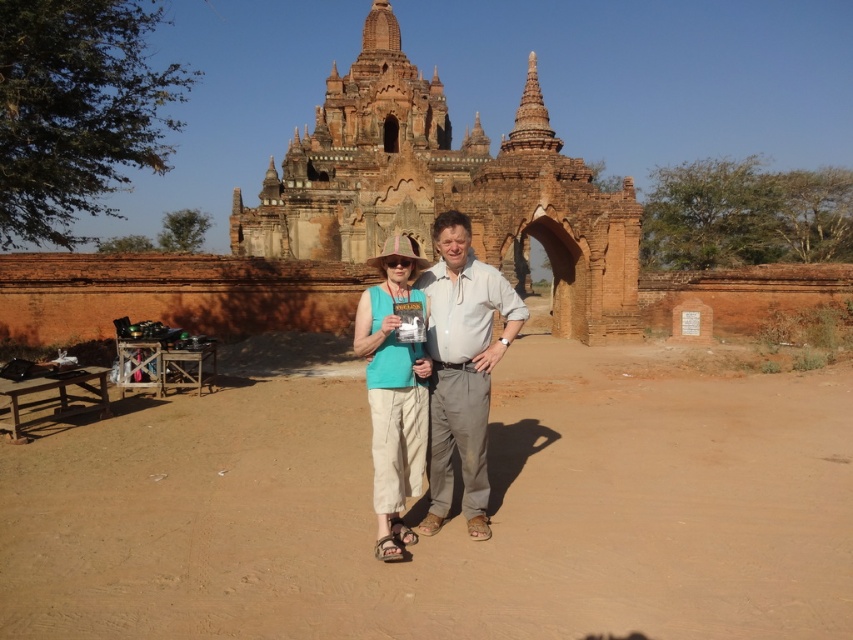
Question: Which point is farther to the camera?

Choices:
 (A) (390, 257)
 (B) (397, 22)
 (C) (436, 499)

Answer: (B)

Question: From the image, what is the correct spatial relationship of brown dirt track at center in relation to matte teal shirt at center?

Choices:
 (A) below
 (B) above

Answer: (A)

Question: Is reddish-brown stone temple at center to the right of matte teal tank top at center from the viewer's perspective?

Choices:
 (A) no
 (B) yes

Answer: (A)

Question: Considering the real-world distances, which object is farthest from the matte teal shirt at center?

Choices:
 (A) reddish-brown stone temple at center
 (B) matte teal tank top at center
 (C) brown dirt track at center

Answer: (A)

Question: Which object is the closest to the brown dirt track at center?

Choices:
 (A) matte teal tank top at center
 (B) matte teal shirt at center
 (C) reddish-brown stone temple at center

Answer: (A)

Question: Is brown dirt track at center further to camera compared to matte teal shirt at center?

Choices:
 (A) yes
 (B) no

Answer: (B)